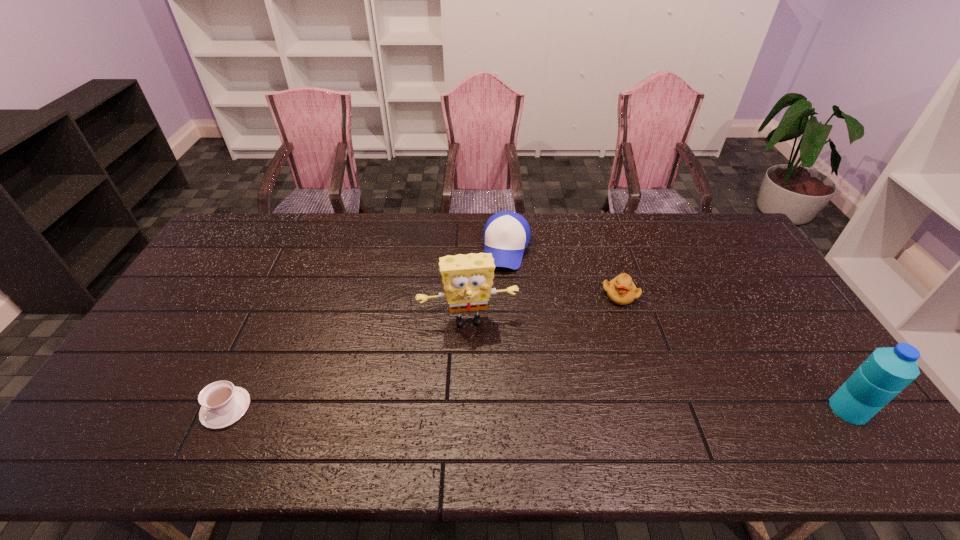
Identify the location of free space on the desktop that is between the shortest object and the water bottle and is positioned at the beak of the duckling. The height and width of the screenshot is (540, 960). (587, 409).

Locate an element on the screen. The image size is (960, 540). vacant space on the desktop that is between the shortest object and the rightmost object and is positioned on the front-facing side of the third tallest object is located at coordinates (469, 408).

Where is `free space on the desktop that is between the shortest object and the water bottle and is positioned on the face of the sponge`? The image size is (960, 540). free space on the desktop that is between the shortest object and the water bottle and is positioned on the face of the sponge is located at coordinates 481,408.